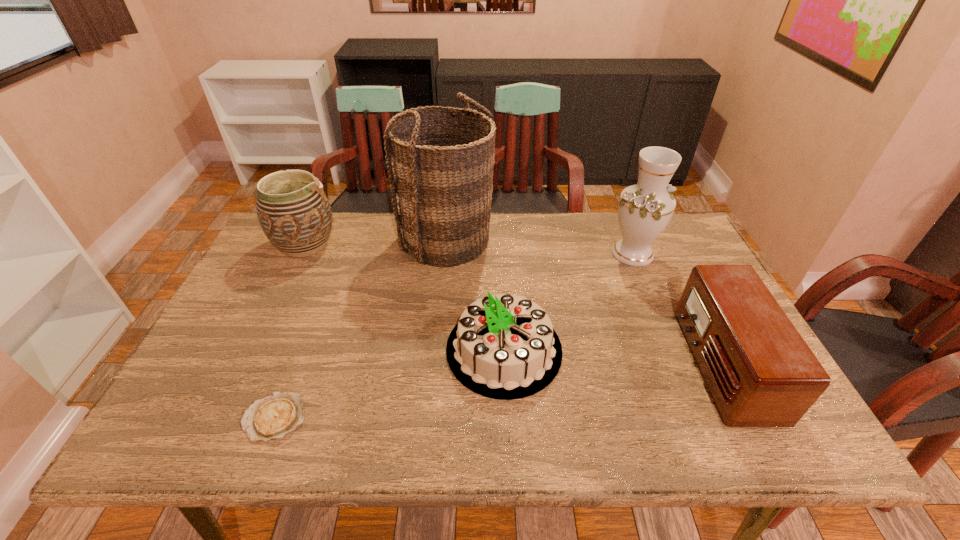
Point out which object is positioned as the fourth nearest to the vase. Please provide its 2D coordinates. Your answer should be formatted as a tuple, i.e. [(x, y)], where the tuple contains the x and y coordinates of a point satisfying the conditions above.

[(293, 210)]

This screenshot has width=960, height=540. I want to click on vacant area that satisfies the following two spatial constraints: 1. on the front side of the quiche; 2. on the left side of the pottery, so click(224, 417).

Locate an element on the screen. free location that satisfies the following two spatial constraints: 1. on the front side of the birthday cake; 2. on the right side of the fourth shortest object is located at coordinates (255, 350).